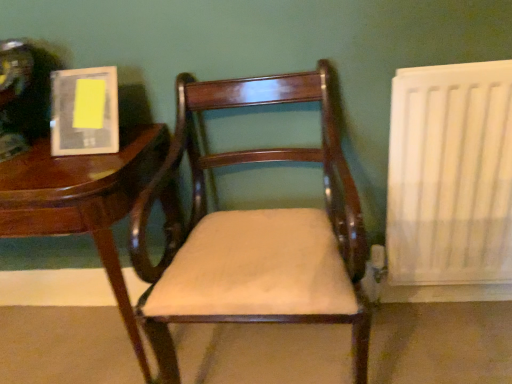
Where is `vacant area that lies in front of matte plastic book at upper left`? vacant area that lies in front of matte plastic book at upper left is located at coordinates (69, 169).